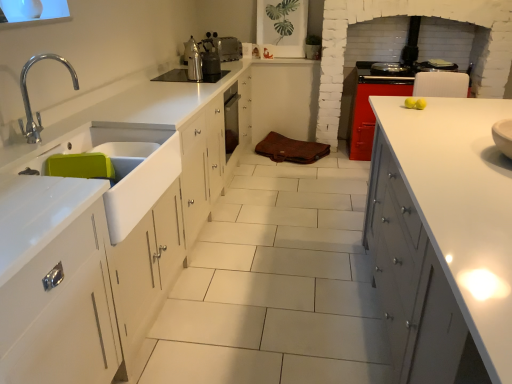
Question: Which direction should I rotate to look at metallic silver kettle at center, the first appliance in the bottom-to-top sequence?

Choices:
 (A) left
 (B) right

Answer: (A)

Question: Can you confirm if black glass cooktop at upper center is wider than white glossy sink at left?

Choices:
 (A) no
 (B) yes

Answer: (B)

Question: Is black glass cooktop at upper center positioned before white glossy sink at left?

Choices:
 (A) yes
 (B) no

Answer: (B)

Question: Is black glass cooktop at upper center not within white glossy sink at left?

Choices:
 (A) no
 (B) yes

Answer: (B)

Question: Is white glossy sink at left inside black glass cooktop at upper center?

Choices:
 (A) yes
 (B) no

Answer: (B)

Question: From the image's perspective, would you say black glass cooktop at upper center is shown under white glossy sink at left?

Choices:
 (A) no
 (B) yes

Answer: (A)

Question: Is black glass cooktop at upper center next to white glossy sink at left and touching it?

Choices:
 (A) no
 (B) yes

Answer: (A)

Question: Is white glossy cabinet at right, marked as the second cabinetry in a top-to-bottom arrangement, oriented away from brown leather bag at center, the 1th cabinetry viewed from the back?

Choices:
 (A) no
 (B) yes

Answer: (A)

Question: From the image's perspective, is white glossy cabinet at right, marked as the 1th cabinetry in a front-to-back arrangement, under brown leather bag at center, which is the first cabinetry from top to bottom?

Choices:
 (A) yes
 (B) no

Answer: (A)

Question: From a real-world perspective, is white glossy cabinet at right, marked as the 1th cabinetry in a front-to-back arrangement, physically below brown leather bag at center, the second cabinetry positioned from the bottom?

Choices:
 (A) yes
 (B) no

Answer: (B)

Question: Can you confirm if white glossy cabinet at right, marked as the 1th cabinetry in a front-to-back arrangement, is bigger than brown leather bag at center, arranged as the second cabinetry when viewed from the front?

Choices:
 (A) no
 (B) yes

Answer: (B)

Question: From a real-world perspective, is white glossy cabinet at right, marked as the second cabinetry in a top-to-bottom arrangement, over brown leather bag at center, the second cabinetry positioned from the bottom?

Choices:
 (A) no
 (B) yes

Answer: (B)

Question: Is brown leather bag at center, arranged as the second cabinetry when viewed from the front, a part of white glossy cabinet at right, which appears as the 2th cabinetry when viewed from the back?

Choices:
 (A) yes
 (B) no

Answer: (B)

Question: Is shiny metallic stove at upper right to the right of white glossy sink at left from the viewer's perspective?

Choices:
 (A) no
 (B) yes

Answer: (B)